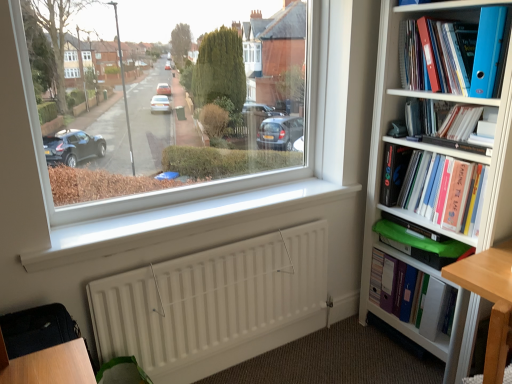
This screenshot has width=512, height=384. Describe the element at coordinates (413, 333) in the screenshot. I see `white plastic shelf at lower right` at that location.

What do you see at coordinates (439, 153) in the screenshot? Image resolution: width=512 pixels, height=384 pixels. I see `white glossy bookcase at right` at bounding box center [439, 153].

Image resolution: width=512 pixels, height=384 pixels. What do you see at coordinates (214, 304) in the screenshot?
I see `white matte radiator at lower center` at bounding box center [214, 304].

In order to face hardcover book at right, placed as the 2th book when sorted from bottom to top, should I rotate leftwards or rightwards?

To face it directly, rotate right by 24.542 degrees.

The image size is (512, 384). In order to click on green plastic case at lower right, the 1th book in the bottom-to-top sequence in this screenshot , I will do `click(429, 297)`.

Where is `blue plastic folder at upper right, which is counted as the first book, starting from the top`? blue plastic folder at upper right, which is counted as the first book, starting from the top is located at coordinates (453, 54).

Find the location of `hardcover book at upper right, positioned as the second book in top-to-bottom order`. hardcover book at upper right, positioned as the second book in top-to-bottom order is located at coordinates (445, 120).

Identify the location of white plastic shelf at lower right. (413, 333).

Is hardcover book at right, the 3th book in the top-to-bottom sequence, far away from blue plastic folder at upper right, which ranks as the 4th book in bottom-to-top order?

They are positioned close to each other.

Can you tell me how much hardcover book at right, placed as the 2th book when sorted from bottom to top, and blue plastic folder at upper right, which is counted as the first book, starting from the top, differ in facing direction?

4.56 degrees separate the facing orientations of hardcover book at right, placed as the 2th book when sorted from bottom to top, and blue plastic folder at upper right, which is counted as the first book, starting from the top.

Does point (398, 201) lie behind point (428, 65)?

Yes, it is behind point (428, 65).

Based on their sizes in the image, would you say hardcover book at right, placed as the 2th book when sorted from bottom to top, is bigger or smaller than blue plastic folder at upper right, which ranks as the 4th book in bottom-to-top order?

hardcover book at right, placed as the 2th book when sorted from bottom to top, is bigger than blue plastic folder at upper right, which ranks as the 4th book in bottom-to-top order.

Is white matte radiator at lower center at the back of white plastic shelf at lower right?

No, white plastic shelf at lower right is not facing away from white matte radiator at lower center.

Considering the relative positions of white plastic shelf at lower right and white matte radiator at lower center in the image provided, is white plastic shelf at lower right to the right of white matte radiator at lower center from the viewer's perspective?

A: Yes, white plastic shelf at lower right is to the right of white matte radiator at lower center.

Which point is more forward, (379, 316) or (248, 259)?

The point (248, 259) is in front.

Who is bigger, blue plastic folder at upper right, which is counted as the first book, starting from the top, or hardcover book at upper right, placed as the third book when sorted from bottom to top?

blue plastic folder at upper right, which is counted as the first book, starting from the top.

Starting from the blue plastic folder at upper right, which is counted as the first book, starting from the top, which book is the 2nd one to the right? Please provide its 2D coordinates.

[(445, 120)]

Relative to hardcover book at upper right, placed as the third book when sorted from bottom to top, is blue plastic folder at upper right, which ranks as the 4th book in bottom-to-top order, in front or behind?

Clearly, blue plastic folder at upper right, which ranks as the 4th book in bottom-to-top order, is in front of hardcover book at upper right, placed as the third book when sorted from bottom to top.

Looking at this image, could you tell me if blue plastic folder at upper right, which ranks as the 4th book in bottom-to-top order, is facing hardcover book at upper right, positioned as the second book in top-to-bottom order?

No, blue plastic folder at upper right, which ranks as the 4th book in bottom-to-top order, does not turn towards hardcover book at upper right, positioned as the second book in top-to-bottom order.

Where is `book lying above the hardcover book at upper right, placed as the third book when sorted from bottom to top (from the image's perspective)`? The height and width of the screenshot is (384, 512). book lying above the hardcover book at upper right, placed as the third book when sorted from bottom to top (from the image's perspective) is located at coordinates (453, 54).

From the image's perspective, between hardcover book at upper right, placed as the third book when sorted from bottom to top, and blue plastic folder at upper right, which ranks as the 4th book in bottom-to-top order, which one is located above?

blue plastic folder at upper right, which ranks as the 4th book in bottom-to-top order, appears higher in the image.

In the image, is hardcover book at upper right, placed as the third book when sorted from bottom to top, positioned in front of or behind blue plastic folder at upper right, which is counted as the first book, starting from the top?

In the image, hardcover book at upper right, placed as the third book when sorted from bottom to top, appears behind blue plastic folder at upper right, which is counted as the first book, starting from the top.

In the scene shown: Considering the positions of objects white matte radiator at lower center and hardcover book at right, the 3th book in the top-to-bottom sequence, in the image provided, who is in front, white matte radiator at lower center or hardcover book at right, the 3th book in the top-to-bottom sequence,?

white matte radiator at lower center is in front.

Do you think white matte radiator at lower center is within hardcover book at right, placed as the 2th book when sorted from bottom to top, or outside of it?

white matte radiator at lower center is located beyond the bounds of hardcover book at right, placed as the 2th book when sorted from bottom to top.

Can you tell me how much white matte radiator at lower center and hardcover book at right, the 3th book in the top-to-bottom sequence, differ in facing direction?

There is a 90.1-degree angle between the facing directions of white matte radiator at lower center and hardcover book at right, the 3th book in the top-to-bottom sequence.

Would you consider white matte radiator at lower center to be distant from hardcover book at right, placed as the 2th book when sorted from bottom to top?

That's not correct — white matte radiator at lower center is a little close to hardcover book at right, placed as the 2th book when sorted from bottom to top.

Which is behind, point (439, 340) or point (503, 25)?

Positioned behind is point (439, 340).

Does white plastic shelf at lower right appear on the left side of blue plastic folder at upper right?

Correct, you'll find white plastic shelf at lower right to the left of blue plastic folder at upper right.

Is the depth of white plastic shelf at lower right greater than that of blue plastic folder at upper right?

That is True.

Consider the image. Is white plastic shelf at lower right not near blue plastic folder at upper right?

Answer: Yes, white plastic shelf at lower right and blue plastic folder at upper right are located far from each other.

Would you consider hardcover book at upper right, placed as the third book when sorted from bottom to top, to be distant from white matte radiator at lower center?

Indeed, hardcover book at upper right, placed as the third book when sorted from bottom to top, is not near white matte radiator at lower center.

Is hardcover book at upper right, placed as the third book when sorted from bottom to top, wider than white matte radiator at lower center?

Correct, the width of hardcover book at upper right, placed as the third book when sorted from bottom to top, exceeds that of white matte radiator at lower center.

Is hardcover book at upper right, positioned as the second book in top-to-bottom order, oriented towards white matte radiator at lower center?

No.

How different are the orientations of hardcover book at upper right, placed as the third book when sorted from bottom to top, and white matte radiator at lower center in degrees?

88.5 degrees.

From a real-world perspective, count 2nd books upward from the hardcover book at right, placed as the 2th book when sorted from bottom to top, and point to it. Please provide its 2D coordinates.

[(453, 54)]

In order to click on shelf below the white matte radiator at lower center (from the image's perspective) in this screenshot , I will do `click(413, 333)`.

Considering their positions, is blue plastic folder at upper right, which ranks as the 4th book in bottom-to-top order, positioned closer to white glossy bookcase at right than white plastic shelf at lower right?

blue plastic folder at upper right, which ranks as the 4th book in bottom-to-top order, is closer to white glossy bookcase at right.

When comparing their distances from blue plastic folder at upper right, does white plastic shelf at lower right or hardcover book at right, the 3th book in the top-to-bottom sequence, seem further?

white plastic shelf at lower right is positioned further to the anchor blue plastic folder at upper right.

Looking at the image, which one is located closer to white plastic shelf at lower right, blue plastic folder at upper right or white glossy bookcase at right?

white glossy bookcase at right is positioned closer to the anchor white plastic shelf at lower right.

Considering their positions, is white glossy bookcase at right positioned closer to white smooth window sill at center than hardcover book at upper right, positioned as the second book in top-to-bottom order?

white glossy bookcase at right is closer to white smooth window sill at center.

Considering their positions, is hardcover book at right, the 3th book in the top-to-bottom sequence, positioned closer to white smooth window sill at center than white plastic shelf at lower right?

Among the two, hardcover book at right, the 3th book in the top-to-bottom sequence, is located nearer to white smooth window sill at center.

From the image, which object appears to be farther from green plastic case at lower right, the 1th book in the bottom-to-top sequence, hardcover book at upper right, positioned as the second book in top-to-bottom order, or hardcover book at right, placed as the 2th book when sorted from bottom to top?

hardcover book at upper right, positioned as the second book in top-to-bottom order, lies further to green plastic case at lower right, the 1th book in the bottom-to-top sequence, than the other object.

Considering their positions, is white glossy bookcase at right positioned further to green plastic case at lower right, which is counted as the fourth book, starting from the top, than white matte radiator at lower center?

white matte radiator at lower center is positioned further to the anchor green plastic case at lower right, which is counted as the fourth book, starting from the top.

Which object lies further to the anchor point hardcover book at right, placed as the 2th book when sorted from bottom to top, blue plastic folder at upper right or white matte radiator at lower center?

white matte radiator at lower center is positioned further to the anchor hardcover book at right, placed as the 2th book when sorted from bottom to top.

You are a GUI agent. You are given a task and a screenshot of the screen. Output one action in this format:
    pyautogui.click(x=<x>, y=<y>)
    Task: Click on the book between white smooth window sill at center and blue plastic folder at upper right, which is counted as the first book, starting from the top, in the horizontal direction
    This screenshot has width=512, height=384.
    Given the screenshot: What is the action you would take?
    pyautogui.click(x=429, y=297)

This screenshot has width=512, height=384. Find the location of `bookcase between hardcover book at upper right, placed as the third book when sorted from bottom to top, and white plastic shelf at lower right in the up-down direction`. bookcase between hardcover book at upper right, placed as the third book when sorted from bottom to top, and white plastic shelf at lower right in the up-down direction is located at coordinates (439, 153).

This screenshot has width=512, height=384. What are the coordinates of `bookcase located between white matte radiator at lower center and hardcover book at upper right, positioned as the second book in top-to-bottom order, in the left-right direction` in the screenshot? It's located at (439, 153).

The width and height of the screenshot is (512, 384). I want to click on bookcase between white matte radiator at lower center and hardcover book at right, the 3th book in the top-to-bottom sequence, in the horizontal direction, so click(x=439, y=153).